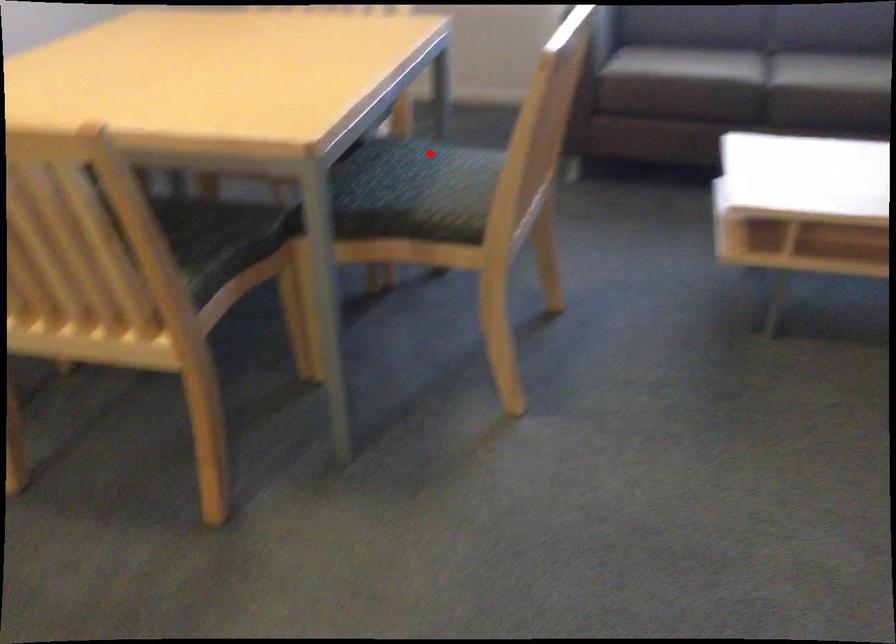
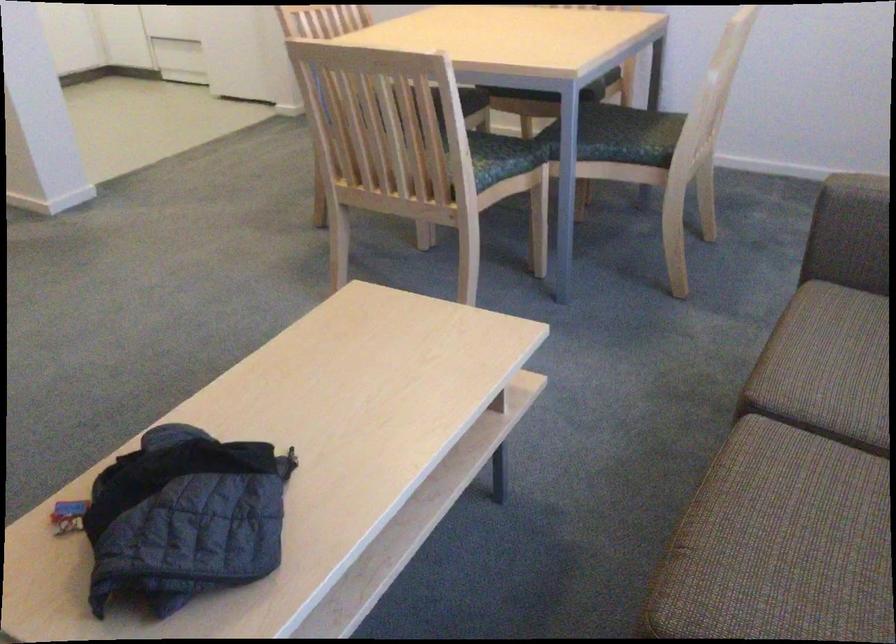
Question: I am providing you with two images of the same scene from different viewpoints. Image1 has a red point marked. In image2, the corresponding 3D location appears at what relative position? Reply with the corresponding letter.

Choices:
 (A) Closer
 (B) Farther

Answer: (B)